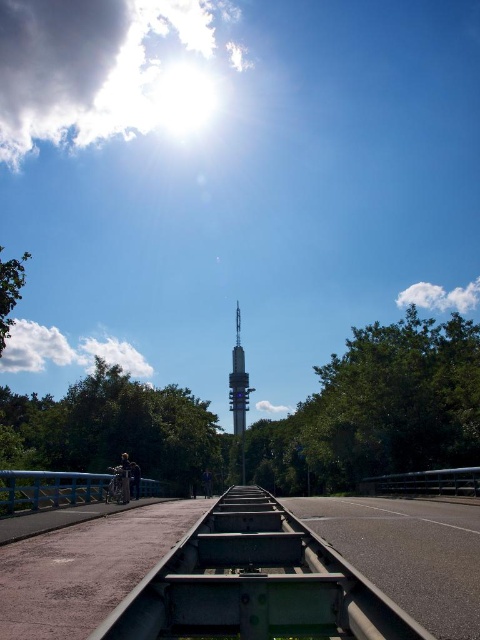
Question: Which object is closer to the camera taking this photo?

Choices:
 (A) black metal rail at right
 (B) blue painted metal rail at lower left
 (C) asphalt road at center

Answer: (C)

Question: Is metallic gray train track at center below black metal rail at right?

Choices:
 (A) yes
 (B) no

Answer: (B)

Question: Is the position of metallic gray train track at center more distant than that of blue painted metal rail at lower left?

Choices:
 (A) yes
 (B) no

Answer: (B)

Question: Among these points, which one is farthest from the camera?

Choices:
 (A) (295, 634)
 (B) (373, 509)

Answer: (B)

Question: Estimate the real-world distances between objects in this image. Which object is closer to the metallic gray train track at center?

Choices:
 (A) blue painted metal rail at lower left
 (B) black metal rail at right
 (C) metallic silver tower at center

Answer: (A)

Question: In this image, where is blue painted metal rail at lower left located relative to metallic silver tower at center?

Choices:
 (A) right
 (B) left

Answer: (B)